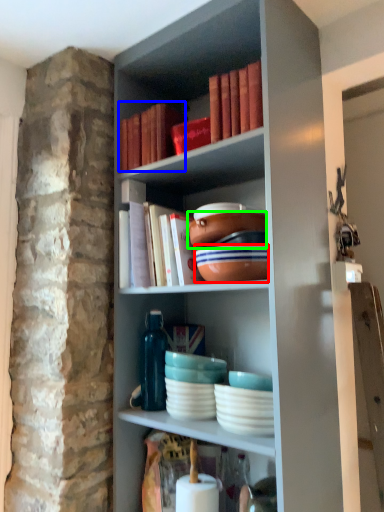
Question: Estimate the real-world distances between objects in this image. Which object is closer to bowl (highlighted by a red box), book (highlighted by a blue box) or bowl (highlighted by a green box)?

Choices:
 (A) book
 (B) bowl

Answer: (B)